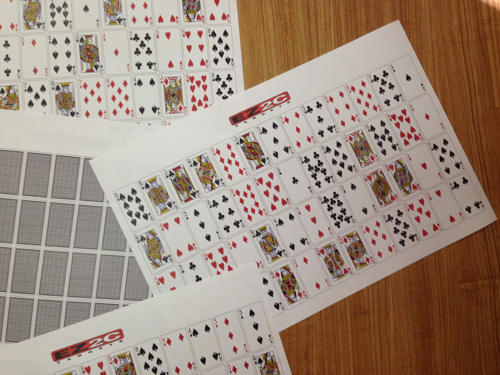
I want to click on sheets, so click(x=108, y=173), click(x=175, y=320).